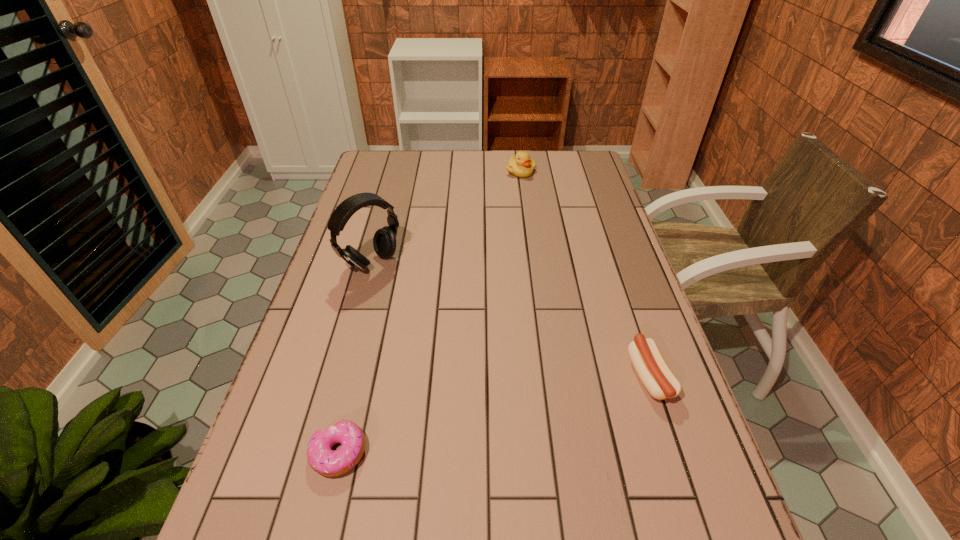
The height and width of the screenshot is (540, 960). In order to click on free space between the nearest object and the sausage in this screenshot , I will do `click(494, 414)`.

At what (x,y) coordinates should I click in order to perform the action: click on vacant area that lies between the second object from right to left and the second nearest object. Please return your answer as a coordinate pair (x, y). This screenshot has width=960, height=540. Looking at the image, I should click on (585, 274).

Image resolution: width=960 pixels, height=540 pixels. Find the location of `vacant area that lies between the earphone and the third shortest object`. vacant area that lies between the earphone and the third shortest object is located at coordinates (446, 218).

You are a GUI agent. You are given a task and a screenshot of the screen. Output one action in this format:
    pyautogui.click(x=<x>, y=<y>)
    Task: Click on the free space between the sausage and the shortest object
    Image resolution: width=960 pixels, height=540 pixels.
    Given the screenshot: What is the action you would take?
    pyautogui.click(x=494, y=414)

The width and height of the screenshot is (960, 540). I want to click on empty space between the third nearest object and the second tallest object, so click(446, 218).

What are the coordinates of `empty space between the doughnut and the third nearest object` in the screenshot? It's located at (355, 358).

Where is `free spot between the second nearest object and the second farthest object`? Image resolution: width=960 pixels, height=540 pixels. free spot between the second nearest object and the second farthest object is located at coordinates (511, 320).

Select which object appears as the closest to the second object from right to left. Please provide its 2D coordinates. Your answer should be formatted as a tuple, i.e. [(x, y)], where the tuple contains the x and y coordinates of a point satisfying the conditions above.

[(384, 241)]

Locate which object is the third closest to the tallest object. Please provide its 2D coordinates. Your answer should be formatted as a tuple, i.e. [(x, y)], where the tuple contains the x and y coordinates of a point satisfying the conditions above.

[(650, 366)]

I want to click on free space that satisfies the following two spatial constraints: 1. on the front side of the third nearest object; 2. on the right side of the nearest object, so click(321, 453).